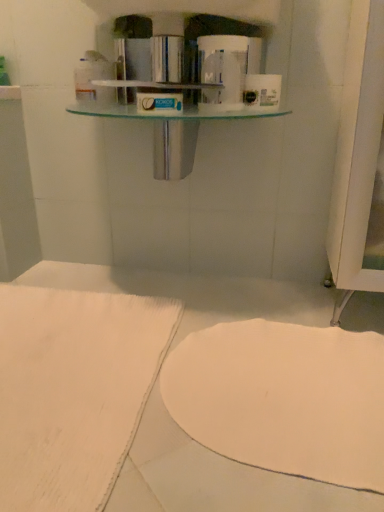
Locate an element on the screen. The image size is (384, 512). free spot above white matte towel at lower center (from a real-world perspective) is located at coordinates (281, 377).